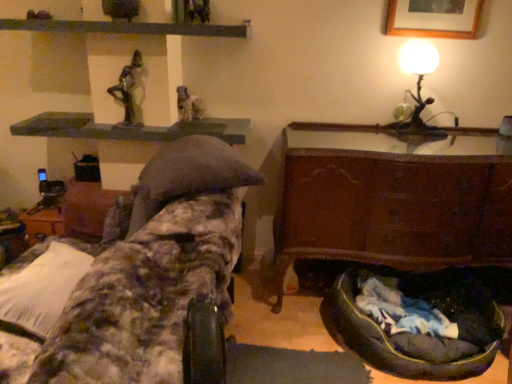
The image size is (512, 384). Identify the location of vacant area that is in front of matte stone statue at upper center, marked as the 2th sculpture in a front-to-back arrangement. (182, 126).